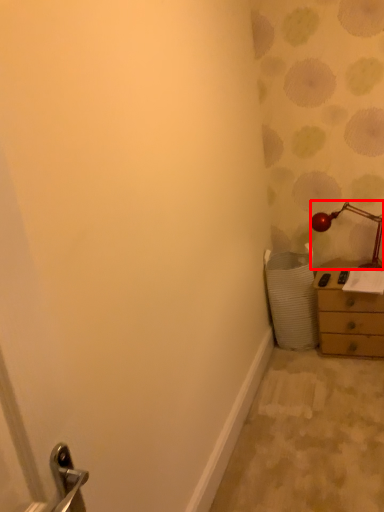
Question: From the image, what is the correct spatial relationship of lamp (annotated by the red box) in relation to chest of drawers?

Choices:
 (A) right
 (B) left

Answer: (B)